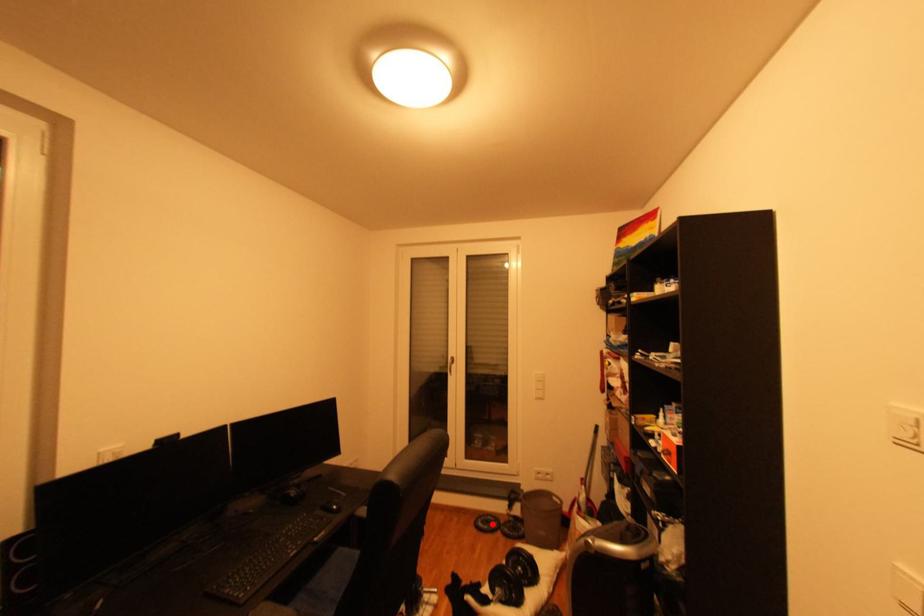
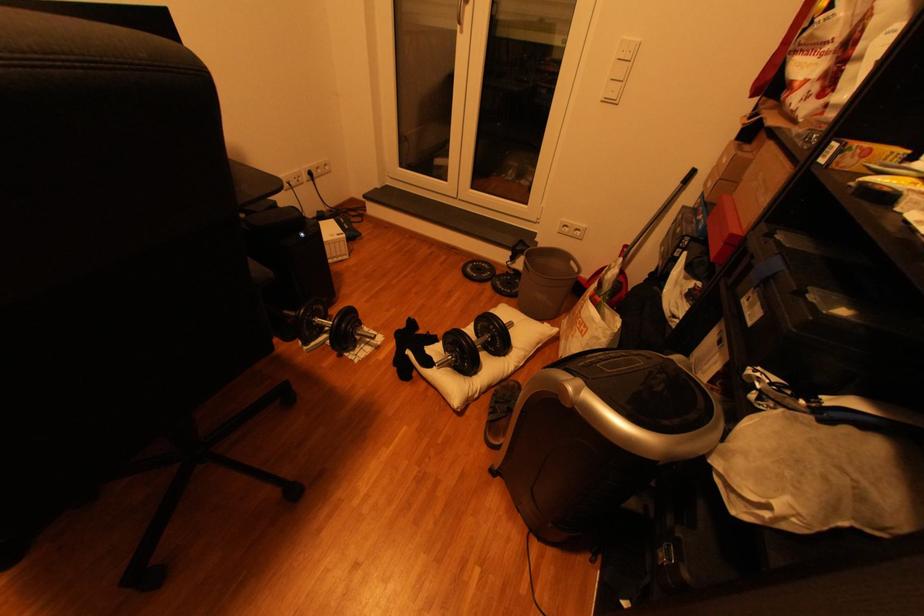
Question: I am providing you with two images of the same scene from different viewpoints. Given a red point in image1, look at the same physical point in image2. Is it:

Choices:
 (A) Closer to the viewpoint
 (B) Farther from the viewpoint

Answer: (A)